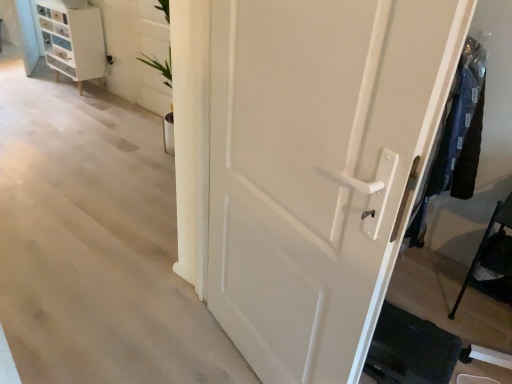
Find the location of a particular element. The height and width of the screenshot is (384, 512). white matte door at center is located at coordinates (318, 168).

The height and width of the screenshot is (384, 512). What do you see at coordinates (456, 138) in the screenshot?
I see `dark blue fabric at right` at bounding box center [456, 138].

In order to face white glossy chest of drawers at upper left, should I rotate leftwards or rightwards?

You should rotate left by 23.542 degrees.

The width and height of the screenshot is (512, 384). Identify the location of white matte door at center. (318, 168).

Is dark blue fabric at right to the left of white glossy chest of drawers at upper left from the viewer's perspective?

Incorrect, dark blue fabric at right is not on the left side of white glossy chest of drawers at upper left.

Is dark blue fabric at right far from white glossy chest of drawers at upper left?

That's right, there is a large distance between dark blue fabric at right and white glossy chest of drawers at upper left.

From the image's perspective, does dark blue fabric at right appear higher than white glossy chest of drawers at upper left?

No, from the image's perspective, dark blue fabric at right is not above white glossy chest of drawers at upper left.

Would you say dark blue fabric at right is outside white glossy chest of drawers at upper left?

dark blue fabric at right is positioned outside white glossy chest of drawers at upper left.

Is white glossy chest of drawers at upper left closer to camera compared to black metal cane at lower right?

No.

Which is closer to the camera, (48, 38) or (462, 290)?

Point (48, 38) is positioned farther from the camera compared to point (462, 290).

Looking at this image, considering the sizes of white glossy chest of drawers at upper left and black metal cane at lower right in the image, is white glossy chest of drawers at upper left bigger or smaller than black metal cane at lower right?

Considering their sizes, white glossy chest of drawers at upper left takes up more space than black metal cane at lower right.

Is white matte door at center next to black metal cane at lower right and touching it?

No, white matte door at center is not making contact with black metal cane at lower right.

Considering the relative sizes of white matte door at center and black metal cane at lower right in the image provided, is white matte door at center bigger than black metal cane at lower right?

Indeed, white matte door at center has a larger size compared to black metal cane at lower right.

Does white matte door at center turn towards black metal cane at lower right?

No.

Is white matte door at center taller or shorter than black metal cane at lower right?

Clearly, white matte door at center is taller compared to black metal cane at lower right.

Can you see dark blue fabric at right touching white matte door at center?

No.

Is dark blue fabric at right thinner than white matte door at center?

No, dark blue fabric at right is not thinner than white matte door at center.

The height and width of the screenshot is (384, 512). I want to click on the chest of drawers located behind the white matte door at center, so click(73, 41).

How much distance is there between white matte door at center and white glossy chest of drawers at upper left?

3.45 meters.

Which is more to the left, white matte door at center or white glossy chest of drawers at upper left?

white glossy chest of drawers at upper left is more to the left.

Can you see white matte door at center touching white glossy chest of drawers at upper left?

No, white matte door at center is not touching white glossy chest of drawers at upper left.

From the image's perspective, is dark blue fabric at right located beneath black metal cane at lower right?

No, from the image's perspective, dark blue fabric at right is not beneath black metal cane at lower right.

Consider the image. Is dark blue fabric at right completely or partially outside of black metal cane at lower right?

Yes, dark blue fabric at right is not within black metal cane at lower right.

Looking at the image, does dark blue fabric at right seem bigger or smaller compared to black metal cane at lower right?

dark blue fabric at right is smaller than black metal cane at lower right.

Considering the positions of objects dark blue fabric at right and black metal cane at lower right in the image provided, who is more to the right, dark blue fabric at right or black metal cane at lower right?

black metal cane at lower right.

Which of these two, white glossy chest of drawers at upper left or dark blue fabric at right, is bigger?

white glossy chest of drawers at upper left is bigger.

From the image's perspective, is white glossy chest of drawers at upper left positioned above or below dark blue fabric at right?

white glossy chest of drawers at upper left is situated higher than dark blue fabric at right in the image.

Which is correct: white glossy chest of drawers at upper left is inside dark blue fabric at right, or outside of it?

white glossy chest of drawers at upper left is located beyond the bounds of dark blue fabric at right.

Which is in front, point (47, 17) or point (454, 174)?

The point (454, 174) is more forward.

The width and height of the screenshot is (512, 384). Find the location of `the chest of drawers lying behind the dark blue fabric at right`. the chest of drawers lying behind the dark blue fabric at right is located at coordinates (73, 41).

I want to click on the chest of drawers positioned vertically above the black metal cane at lower right (from a real-world perspective), so click(73, 41).

From the picture: From the image, which object appears to be nearer to white glossy chest of drawers at upper left, black metal cane at lower right or white matte door at center?

Based on the image, white matte door at center appears to be nearer to white glossy chest of drawers at upper left.

When comparing their distances from black metal cane at lower right, does white glossy chest of drawers at upper left or dark blue fabric at right seem closer?

dark blue fabric at right is positioned closer to the anchor black metal cane at lower right.

Based on the photo, considering their positions, is white glossy chest of drawers at upper left positioned further to dark blue fabric at right than black metal cane at lower right?

The object further to dark blue fabric at right is white glossy chest of drawers at upper left.

Which object lies nearer to the anchor point white glossy chest of drawers at upper left, dark blue fabric at right or black metal cane at lower right?

The object closer to white glossy chest of drawers at upper left is dark blue fabric at right.

Estimate the real-world distances between objects in this image. Which object is further from white glossy chest of drawers at upper left, black metal cane at lower right or dark blue fabric at right?

black metal cane at lower right is positioned further to the anchor white glossy chest of drawers at upper left.

Considering their positions, is white matte door at center positioned further to white glossy chest of drawers at upper left than black metal cane at lower right?

black metal cane at lower right is positioned further to the anchor white glossy chest of drawers at upper left.

Which object lies nearer to the anchor point white matte door at center, white glossy chest of drawers at upper left or black metal cane at lower right?

Among the two, black metal cane at lower right is located nearer to white matte door at center.

Considering their positions, is white glossy chest of drawers at upper left positioned further to black metal cane at lower right than white matte door at center?

white glossy chest of drawers at upper left is further to black metal cane at lower right.

Find the location of a particular element. The image size is (512, 384). furniture located between white matte door at center and white glossy chest of drawers at upper left in the depth direction is located at coordinates pos(485,242).

At what (x,y) coordinates should I click in order to perform the action: click on laundry located between white glossy chest of drawers at upper left and black metal cane at lower right in the left-right direction. Please return your answer as a coordinate pair (x, y). The height and width of the screenshot is (384, 512). Looking at the image, I should click on (456, 138).

The width and height of the screenshot is (512, 384). Identify the location of laundry between white matte door at center and white glossy chest of drawers at upper left from front to back. (456, 138).

What are the coordinates of `laundry between white matte door at center and black metal cane at lower right` in the screenshot? It's located at (456, 138).